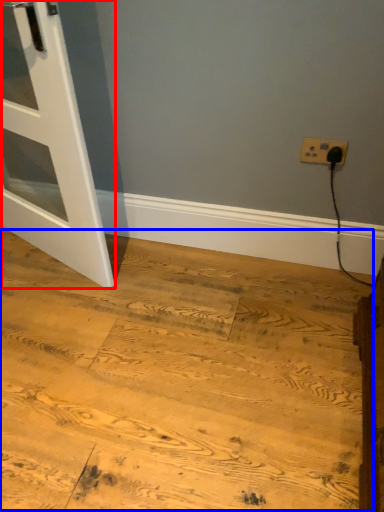
Question: Which object appears closest to the camera in this image, door (highlighted by a red box) or plywood (highlighted by a blue box)?

Choices:
 (A) door
 (B) plywood

Answer: (B)